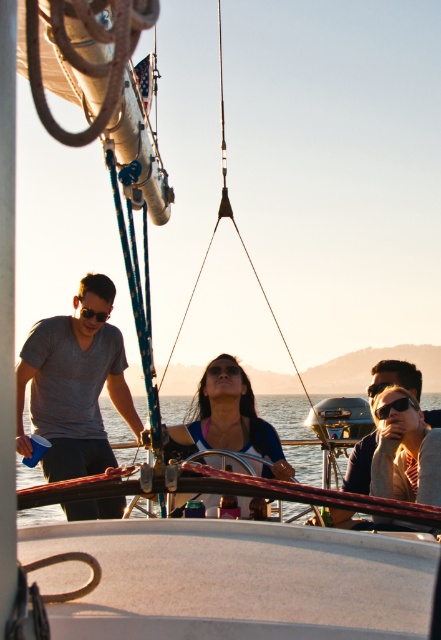
Question: Which point is farther to the camera?

Choices:
 (A) (302, 472)
 (B) (90, 273)
 (C) (201, 378)

Answer: (A)

Question: Which point is farther to the camera?

Choices:
 (A) clear water at center
 (B) gray matte shirt at left

Answer: (B)

Question: Is clear water at center thinner than matte black sunglasses at left?

Choices:
 (A) yes
 (B) no

Answer: (B)

Question: Can you confirm if gray matte shirt at left is positioned above black plastic sunglasses at center?

Choices:
 (A) no
 (B) yes

Answer: (B)

Question: Based on their relative distances, which object is farther from the clear water at center?

Choices:
 (A) gray matte shirt at left
 (B) black plastic goggles at center

Answer: (B)

Question: Does gray matte shirt at left have a greater width compared to black plastic sunglasses at center?

Choices:
 (A) yes
 (B) no

Answer: (A)